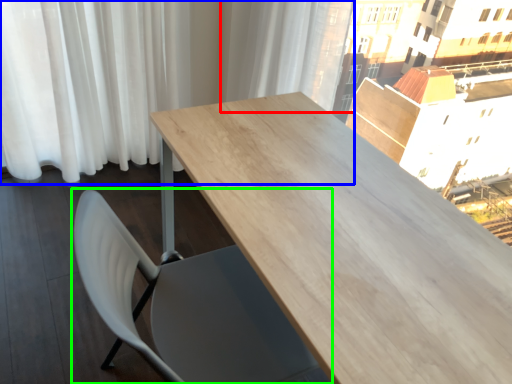
Question: Which is farther away from curtain (highlighted by a red box)? curtain (highlighted by a blue box) or chair (highlighted by a green box)?

Choices:
 (A) curtain
 (B) chair

Answer: (B)